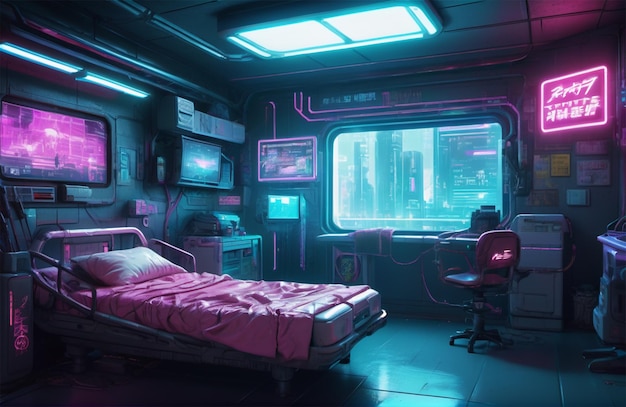
You are a GUI agent. You are given a task and a screenshot of the screen. Output one action in this format:
    pyautogui.click(x=<x>, y=<y>)
    Task: Click on the pillow
    This screenshot has height=407, width=626.
    Given the screenshot: What is the action you would take?
    pyautogui.click(x=131, y=255)